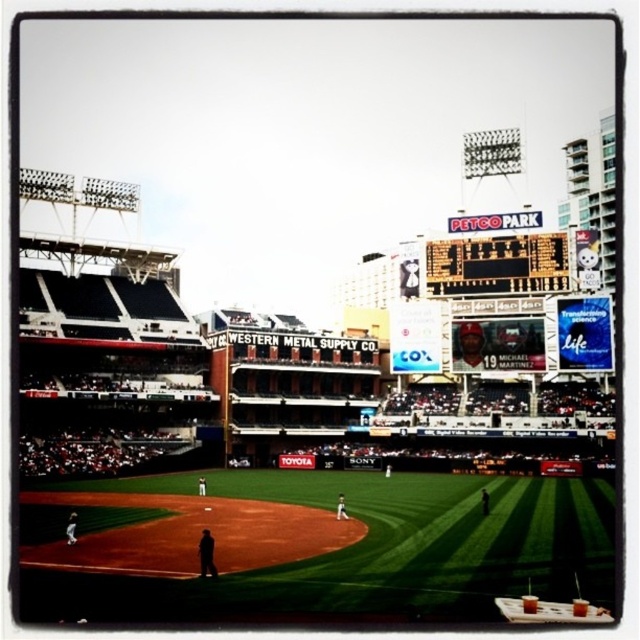
Question: Does white uniform player at center have a greater width compared to black fabric man at center?

Choices:
 (A) no
 (B) yes

Answer: (A)

Question: Which point is closer to the camera?

Choices:
 (A) (340, 493)
 (B) (563, 262)
 (C) (72, 531)
 (D) (204, 488)

Answer: (C)

Question: Can you confirm if white uniform player at center is positioned to the right of dark gray uniform at center?

Choices:
 (A) yes
 (B) no

Answer: (A)

Question: Can you confirm if metallic scoreboard at upper center is positioned below dark brown leather jacket at center?

Choices:
 (A) no
 (B) yes

Answer: (A)

Question: Estimate the real-world distances between objects in this image. Which object is closer to the white uniform player at center?

Choices:
 (A) dark gray uniform at center
 (B) metallic scoreboard at upper center
 (C) white uniform man at center

Answer: (A)

Question: Which of the following is the farthest from the observer?

Choices:
 (A) dark brown leather jacket at center
 (B) white uniform player at center
 (C) black fabric man at center
 (D) white uniform man at center

Answer: (C)